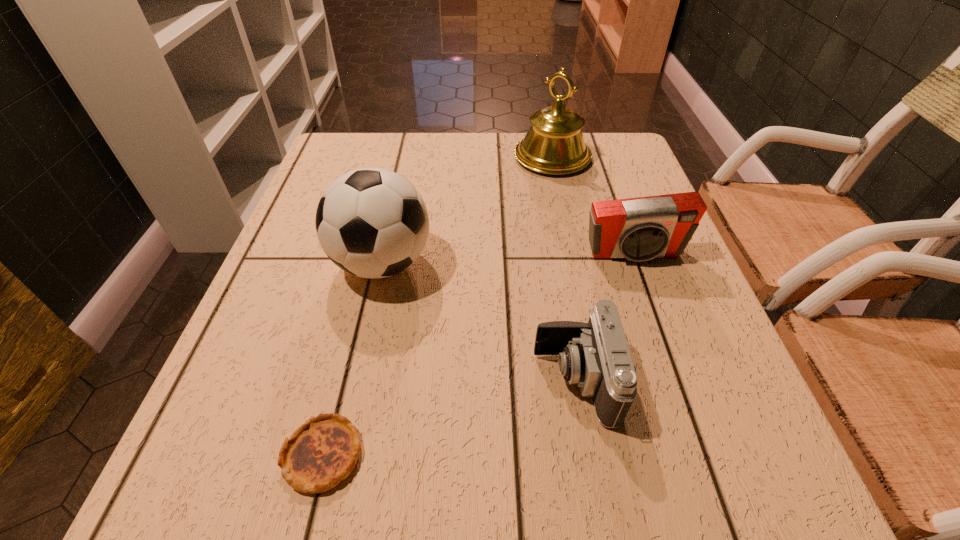
Identify the location of the farthest object. The width and height of the screenshot is (960, 540). (554, 144).

Find the location of a particular element. This screenshot has height=540, width=960. soccer ball is located at coordinates (372, 223).

Locate an element on the screen. This screenshot has width=960, height=540. the third shortest object is located at coordinates (639, 229).

Locate an element on the screen. This screenshot has height=540, width=960. the right camera is located at coordinates (639, 229).

You are a GUI agent. You are given a task and a screenshot of the screen. Output one action in this format:
    pyautogui.click(x=<x>, y=<y>)
    Task: Click on the left camera
    
    Given the screenshot: What is the action you would take?
    pyautogui.click(x=595, y=355)

You are a GUI agent. You are given a task and a screenshot of the screen. Output one action in this format:
    pyautogui.click(x=<x>, y=<y>)
    Task: Click on the shorter camera
    The image size is (960, 540).
    Given the screenshot: What is the action you would take?
    pyautogui.click(x=595, y=355)

Find the location of a particular element. Image resolution: width=960 pixels, height=540 pixels. the shortest object is located at coordinates (323, 451).

This screenshot has width=960, height=540. Find the location of `vacant region located on the front of the bell`. vacant region located on the front of the bell is located at coordinates (567, 228).

You are a GUI agent. You are given a task and a screenshot of the screen. Output one action in this format:
    pyautogui.click(x=<x>, y=<y>)
    Task: Click on the vacant area situated 0.350m on the back of the soccer ball
    
    Given the screenshot: What is the action you would take?
    pyautogui.click(x=408, y=147)

Locate an element on the screen. Image resolution: width=960 pixels, height=540 pixels. free region located on the front-facing side of the right camera is located at coordinates (678, 379).